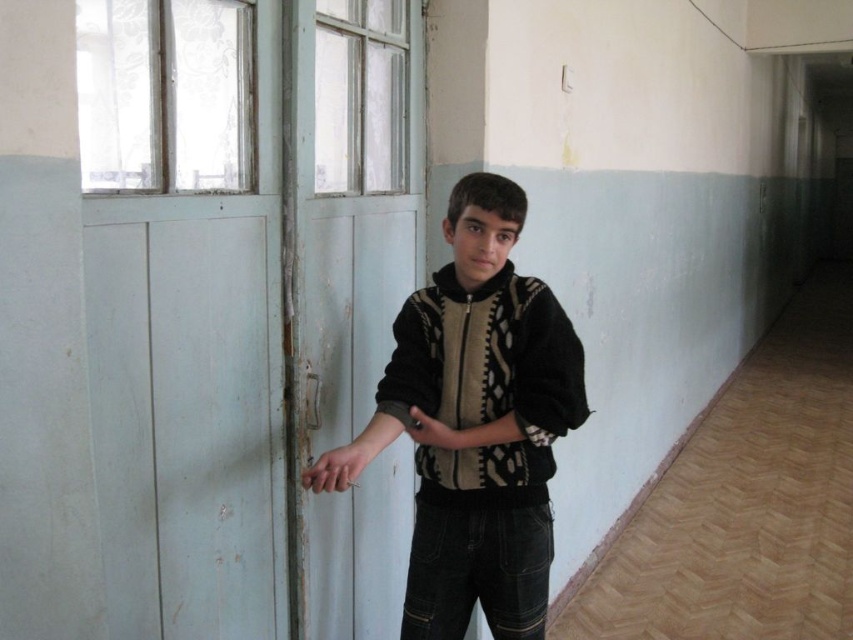
Question: Which object is the farthest from the black textured sweater at center?

Choices:
 (A) black matte arm at center
 (B) knitted sweater at center

Answer: (A)

Question: Is knitted sweater at center smaller than black matte arm at center?

Choices:
 (A) no
 (B) yes

Answer: (A)

Question: Which of the following is the closest to the observer?

Choices:
 (A) knitted sweater at center
 (B) black textured sweater at center
 (C) black matte arm at center

Answer: (C)

Question: Which object appears closest to the camera in this image?

Choices:
 (A) black textured sweater at center
 (B) black matte arm at center

Answer: (B)

Question: Is black textured sweater at center smaller than black matte arm at center?

Choices:
 (A) yes
 (B) no

Answer: (A)

Question: Is knitted sweater at center below black textured sweater at center?

Choices:
 (A) no
 (B) yes

Answer: (B)